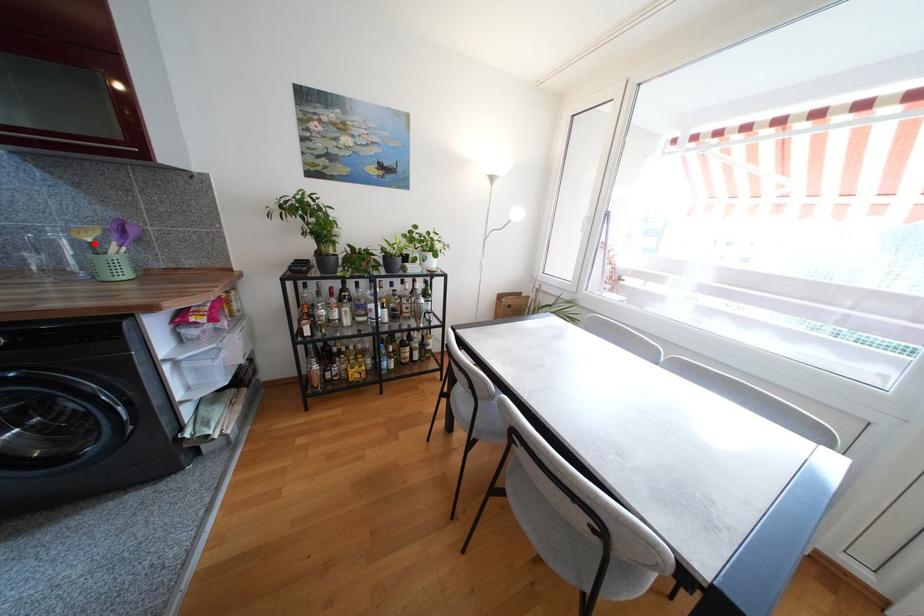
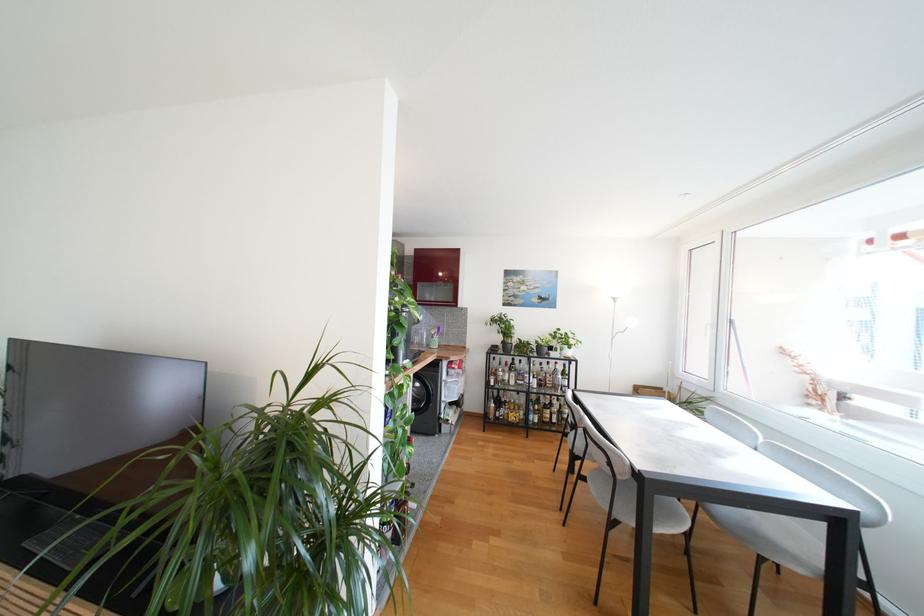
Find the pixel in the second image that matches the highlighted location in the first image.

(436, 336)